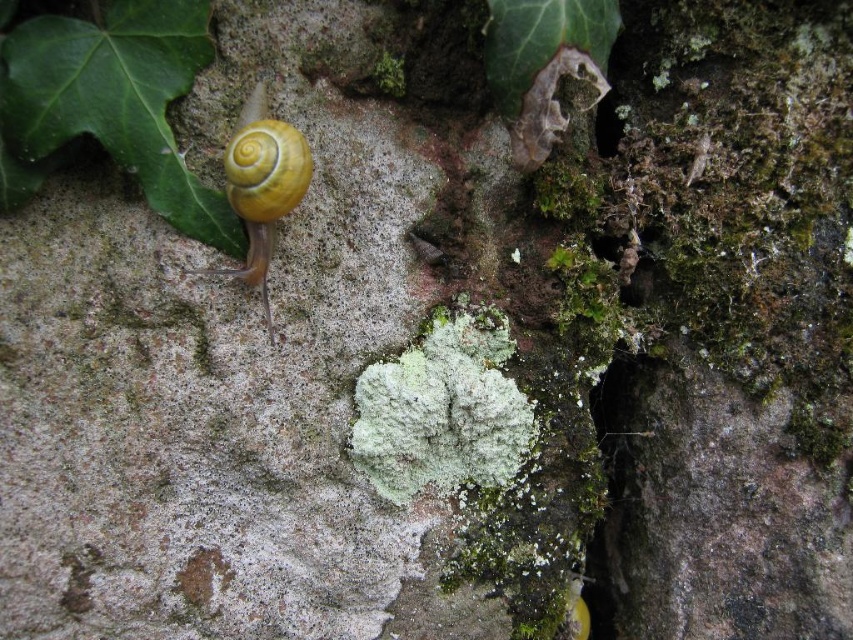
Question: Which object appears closest to the camera in this image?

Choices:
 (A) green matte leaf at upper left
 (B) yellow shiny snail at upper left

Answer: (A)

Question: Observing the image, what is the correct spatial positioning of green matte leaf at upper left in reference to yellow shiny snail at upper left?

Choices:
 (A) above
 (B) below

Answer: (A)

Question: Can you confirm if green matte leaf at upper left is wider than yellow shiny snail at upper left?

Choices:
 (A) yes
 (B) no

Answer: (A)

Question: Which object is closer to the camera taking this photo?

Choices:
 (A) yellow shiny snail at upper left
 (B) green matte leaf at upper left

Answer: (B)

Question: Does green matte leaf at upper left appear on the left side of yellow shiny snail at upper left?

Choices:
 (A) yes
 (B) no

Answer: (A)